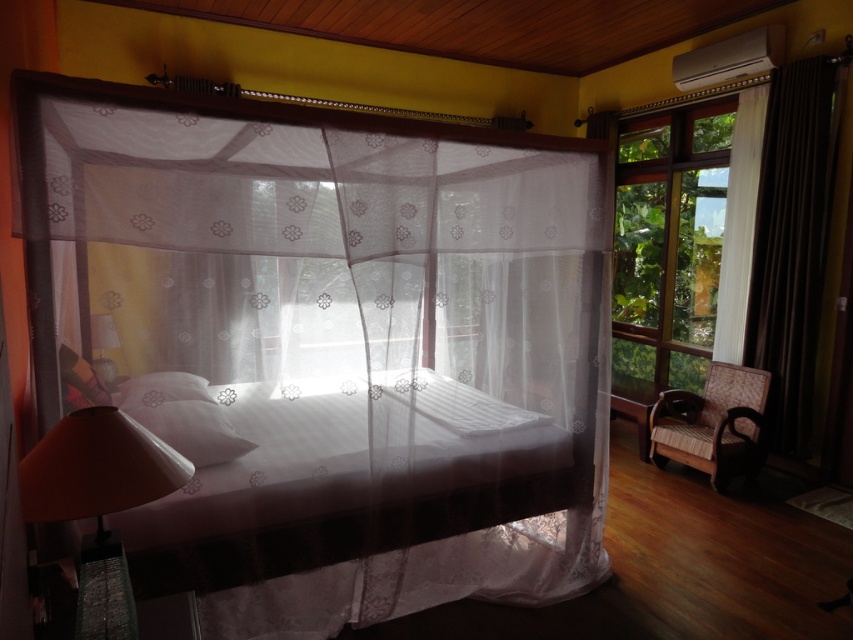
Is transparent glass window at right to the right of white soft pillow at center from the viewer's perspective?

Correct, you'll find transparent glass window at right to the right of white soft pillow at center.

Can you confirm if transparent glass window at right is positioned to the left of white soft pillow at center?

Incorrect, transparent glass window at right is not on the left side of white soft pillow at center.

In the scene shown: Who is more distant from viewer, (616, 362) or (252, 448)?

The point (616, 362) is more distant.

Where is `transparent glass window at right`? The height and width of the screenshot is (640, 853). transparent glass window at right is located at coordinates (682, 246).

Between white sheer mosquito net at center and white soft pillow at center, which one has less height?

With less height is white soft pillow at center.

Is white sheer mosquito net at center thinner than white soft pillow at center?

No, white sheer mosquito net at center is not thinner than white soft pillow at center.

Which is behind, point (514, 506) or point (225, 426)?

Positioned behind is point (514, 506).

Where is `white sheer mosquito net at center`? This screenshot has height=640, width=853. white sheer mosquito net at center is located at coordinates [332, 344].

Between point (808, 192) and point (683, 424), which one is positioned in front?

Positioned in front is point (808, 192).

Based on the photo, is brown velvet curtain at right below woven wood armchair at lower right?

Incorrect, brown velvet curtain at right is not positioned below woven wood armchair at lower right.

Where is `brown velvet curtain at right`? brown velvet curtain at right is located at coordinates (792, 241).